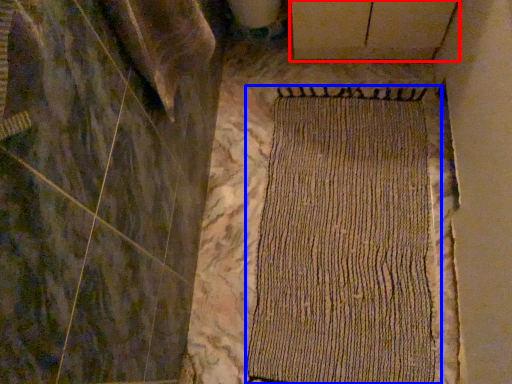
Question: Among these objects, which one is farthest to the camera, plywood (highlighted by a red box) or mat (highlighted by a blue box)?

Choices:
 (A) plywood
 (B) mat

Answer: (A)